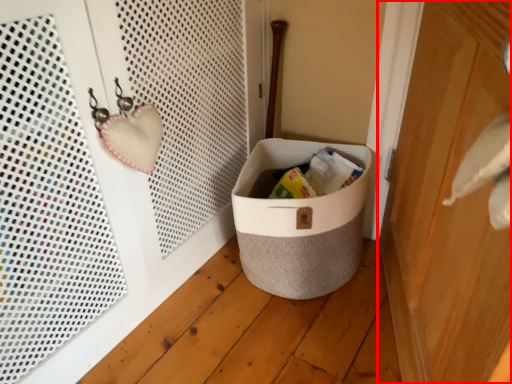
Question: From the image's perspective, where is door (annotated by the red box) located in relation to storage box in the image?

Choices:
 (A) below
 (B) above

Answer: (B)